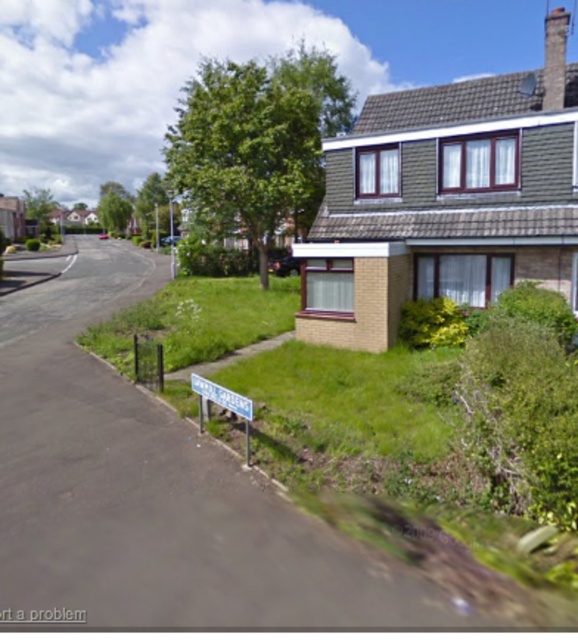
Question: Does blue plastic street sign at lower center come in front of white plastic street sign at lower center?

Choices:
 (A) yes
 (B) no

Answer: (A)

Question: Which point is closer to the camera taking this photo?

Choices:
 (A) (217, 403)
 (B) (195, 392)

Answer: (A)

Question: Is blue plastic street sign at lower center below white plastic street sign at lower center?

Choices:
 (A) no
 (B) yes

Answer: (B)

Question: Which of the following is the farthest from the observer?

Choices:
 (A) blue plastic street sign at lower center
 (B) white plastic street sign at lower center

Answer: (B)

Question: Is blue plastic street sign at lower center thinner than white plastic street sign at lower center?

Choices:
 (A) no
 (B) yes

Answer: (A)